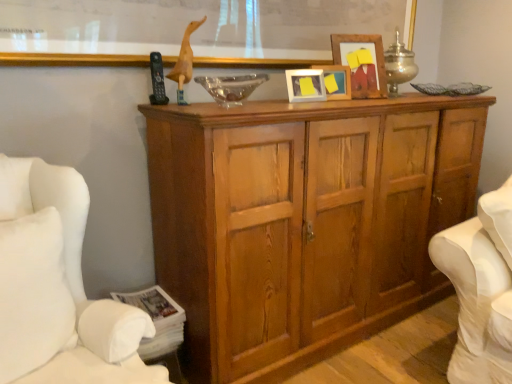
Question: From a real-world perspective, does metallic silver table lamp at upper center stand above wooden frame at upper center?

Choices:
 (A) no
 (B) yes

Answer: (A)

Question: Does metallic silver table lamp at upper center contain wooden frame at upper center?

Choices:
 (A) yes
 (B) no

Answer: (B)

Question: Is metallic silver table lamp at upper center bigger than wooden frame at upper center?

Choices:
 (A) no
 (B) yes

Answer: (A)

Question: Are metallic silver table lamp at upper center and wooden frame at upper center far apart?

Choices:
 (A) yes
 (B) no

Answer: (B)

Question: Does metallic silver table lamp at upper center lie behind wooden frame at upper center?

Choices:
 (A) no
 (B) yes

Answer: (B)

Question: From a real-world perspective, is white fabric swivel chair at right positioned above or below matte wooden picture frame at center, marked as the first picture frame in a left-to-right arrangement?

Choices:
 (A) below
 (B) above

Answer: (A)

Question: In terms of height, does white fabric swivel chair at right look taller or shorter compared to matte wooden picture frame at center, marked as the first picture frame in a left-to-right arrangement?

Choices:
 (A) short
 (B) tall

Answer: (B)

Question: In terms of size, does white fabric swivel chair at right appear bigger or smaller than matte wooden picture frame at center, arranged as the third picture frame when viewed from the right?

Choices:
 (A) big
 (B) small

Answer: (A)

Question: Is white fabric swivel chair at right wider or thinner than matte wooden picture frame at center, marked as the first picture frame in a left-to-right arrangement?

Choices:
 (A) thin
 (B) wide

Answer: (B)

Question: In the image, is wooden cupboard at center positioned in front of or behind wooden picture frame at center, which is the second picture frame from left to right?

Choices:
 (A) front
 (B) behind

Answer: (A)

Question: Do you think wooden cupboard at center is within wooden picture frame at center, which is the second picture frame from left to right, or outside of it?

Choices:
 (A) inside
 (B) outside

Answer: (B)

Question: Looking at their shapes, would you say wooden cupboard at center is wider or thinner than wooden picture frame at center, the second picture frame viewed from the right?

Choices:
 (A) wide
 (B) thin

Answer: (A)

Question: Is point (338, 268) positioned closer to the camera than point (332, 92)?

Choices:
 (A) closer
 (B) farther

Answer: (A)

Question: Considering the positions of transparent glass bowl at center and metallic silver table lamp at upper center in the image, is transparent glass bowl at center taller or shorter than metallic silver table lamp at upper center?

Choices:
 (A) short
 (B) tall

Answer: (A)

Question: Looking at their shapes, would you say transparent glass bowl at center is wider or thinner than metallic silver table lamp at upper center?

Choices:
 (A) thin
 (B) wide

Answer: (B)